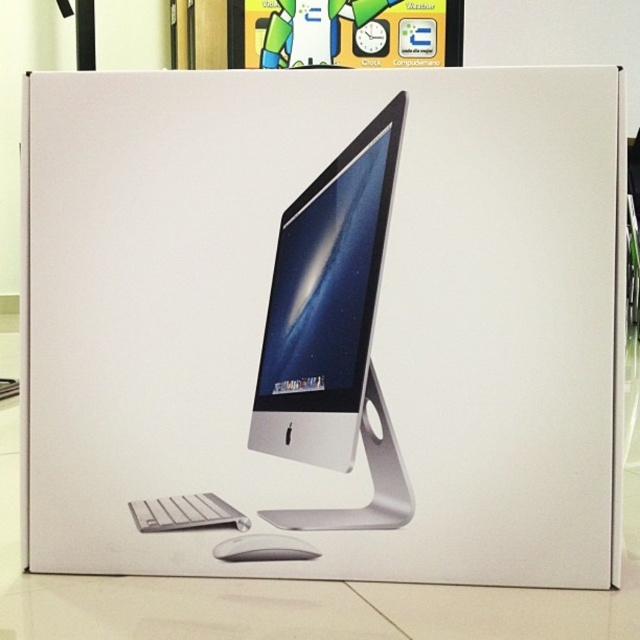
In the scene shown: You are designing a layout for a product box and need to place a sticker on the exact center of the silver metallic computer monitor at center. According to the coordinates provided, where should you position the sticker?

The sticker should be placed at the coordinates point (326, 301) as the silver metallic computer monitor at center is located there.

You are designing a promotional material for the product and need to highlight the keyboard and mouse. Since the white plastic keyboard at lower left and white matte mouse at lower center are both on the packaging box, which one should you focus on if you want to emphasize size differences between them?

The white plastic keyboard at lower left is much taller than the white matte mouse at lower center, so you should focus on the white plastic keyboard at lower left to emphasize the size difference.